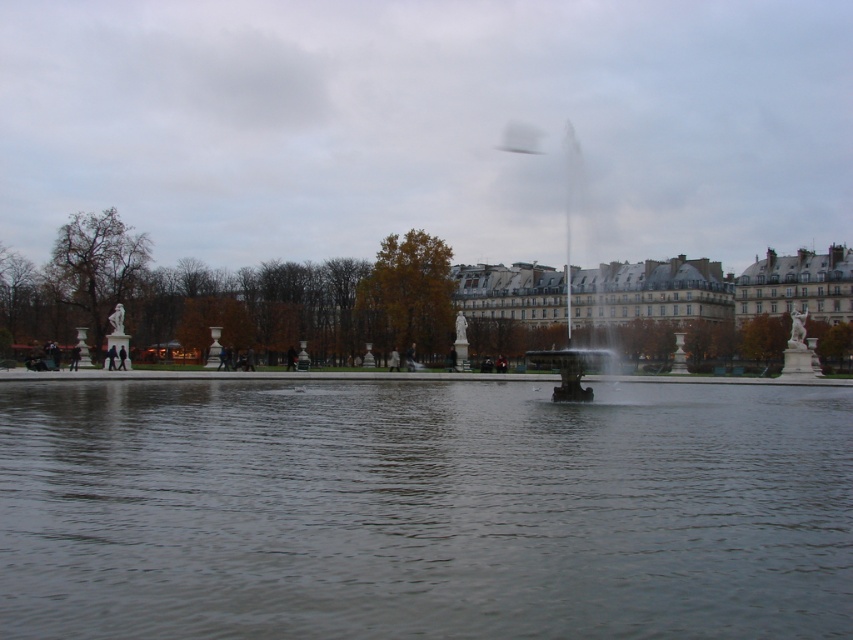
Is transparent water at center to the left of polished bronze fountain at center from the viewer's perspective?

Indeed, transparent water at center is positioned on the left side of polished bronze fountain at center.

Which is behind, point (840, 577) or point (553, 396)?

The point (553, 396) is behind.

Identify the location of transparent water at center. (422, 509).